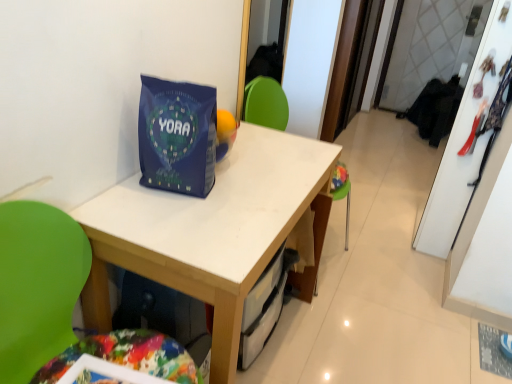
Question: From the image's perspective, is white matte table at center above green plastic chair at center?

Choices:
 (A) no
 (B) yes

Answer: (B)

Question: Considering the relative positions of white matte table at center and green plastic chair at center in the image provided, is white matte table at center to the right of green plastic chair at center from the viewer's perspective?

Choices:
 (A) no
 (B) yes

Answer: (B)

Question: Considering the relative sizes of white matte table at center and green plastic chair at center in the image provided, is white matte table at center wider than green plastic chair at center?

Choices:
 (A) yes
 (B) no

Answer: (B)

Question: Does white matte table at center come behind green plastic chair at center?

Choices:
 (A) yes
 (B) no

Answer: (A)

Question: Could you tell me if white matte table at center is turned towards green plastic chair at center?

Choices:
 (A) yes
 (B) no

Answer: (B)

Question: Is white matte table at center closer to the viewer compared to green plastic chair at center?

Choices:
 (A) no
 (B) yes

Answer: (A)

Question: Is green plastic chair at center completely or partially outside of blue matte gift bag at center?

Choices:
 (A) yes
 (B) no

Answer: (A)

Question: Is green plastic chair at center further to camera compared to blue matte gift bag at center?

Choices:
 (A) no
 (B) yes

Answer: (A)

Question: Is green plastic chair at center facing away from blue matte gift bag at center?

Choices:
 (A) yes
 (B) no

Answer: (B)

Question: Is green plastic chair at center thinner than blue matte gift bag at center?

Choices:
 (A) no
 (B) yes

Answer: (A)

Question: Is green plastic chair at center bigger than blue matte gift bag at center?

Choices:
 (A) yes
 (B) no

Answer: (A)

Question: Is green plastic chair at center taller than blue matte gift bag at center?

Choices:
 (A) yes
 (B) no

Answer: (A)

Question: Considering the relative positions of blue matte gift bag at center and green plastic chair at center in the image provided, is blue matte gift bag at center to the right of green plastic chair at center from the viewer's perspective?

Choices:
 (A) no
 (B) yes

Answer: (B)